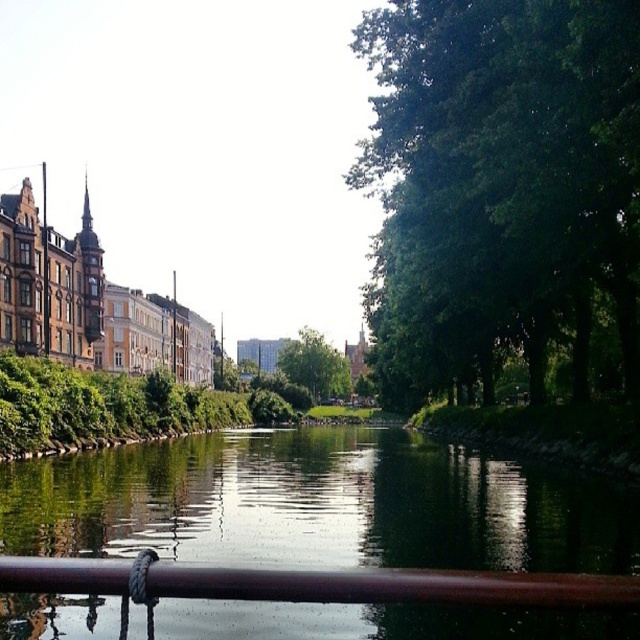
Question: Is green reflective water at center to the right of brown polished metal rail at lower center from the viewer's perspective?

Choices:
 (A) no
 (B) yes

Answer: (B)

Question: Which of the following is the closest to the observer?

Choices:
 (A) (579, 576)
 (B) (93, 616)
 (C) (440, 358)

Answer: (A)

Question: Observing the image, what is the correct spatial positioning of green leafy trees at right in reference to green leafy tree at center?

Choices:
 (A) right
 (B) left

Answer: (A)

Question: Which of the following is the farthest from the observer?

Choices:
 (A) green leafy trees at right
 (B) green leafy tree at center
 (C) brown polished metal rail at lower center
 (D) green reflective water at center

Answer: (B)

Question: Among these points, which one is farthest from the camera?

Choices:
 (A) (522, 216)
 (B) (90, 588)

Answer: (A)

Question: Is the position of green reflective water at center less distant than that of brown polished metal rail at lower center?

Choices:
 (A) no
 (B) yes

Answer: (A)